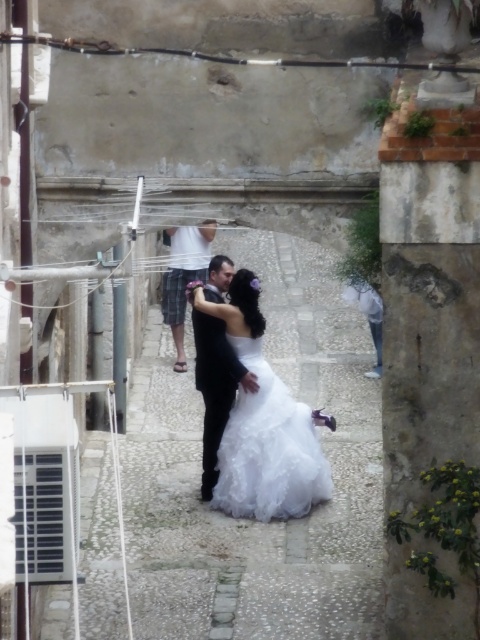
You are a photographer positioned at the end of the alleyway. You notice the black satin suit at center and the white cotton shirt at center. Which one is closer to you?

The black satin suit at center is closer to you because it is further to the viewer than the white cotton shirt at center.

You are a photographer trying to capture a photo of the couple in the alleyway. You notice two points marked in the scene. The first point is at coordinate point (276, 516) and the second point is at coordinate point (165, 288). Which point is closer to your camera lens?

Point (276, 516) is closer to the camera lens than point (165, 288).

In the historic alleyway scene, there are two people dressed in formal attire standing together. The man is wearing a black satin suit at center, and the woman is wearing a white cotton shirt at center. From the observer standing at the entrance of the alleyway, which clothing item is positioned to the right?

The black satin suit at center is to the right of the white cotton shirt at center, so the black satin suit at center is positioned to the right.